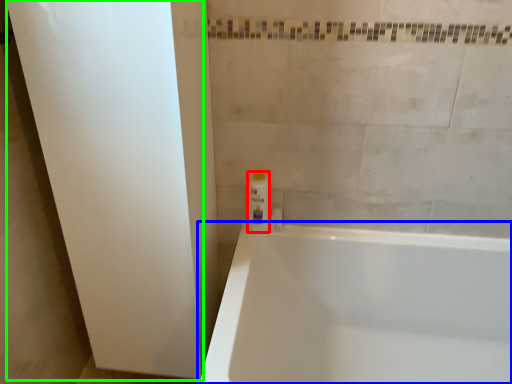
Question: Estimate the real-world distances between objects in this image. Which object is farther from toiletry (highlighted by a red box), bathtub (highlighted by a blue box) or screen door (highlighted by a green box)?

Choices:
 (A) bathtub
 (B) screen door

Answer: (B)